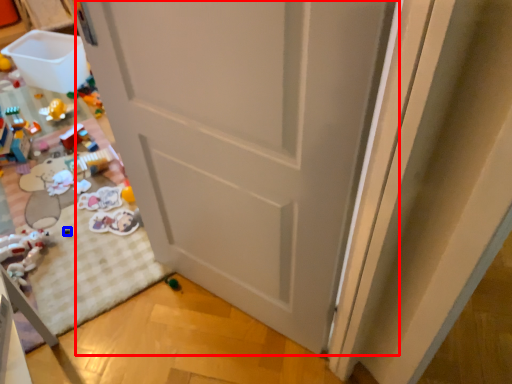
Question: Among these objects, which one is nearest to the camera, door (highlighted by a red box) or toy (highlighted by a blue box)?

Choices:
 (A) door
 (B) toy

Answer: (A)